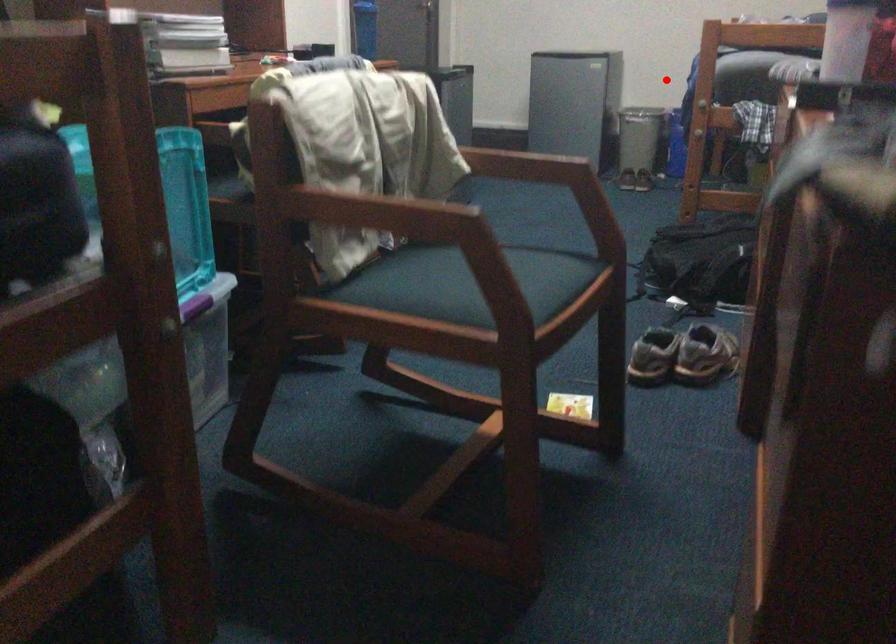
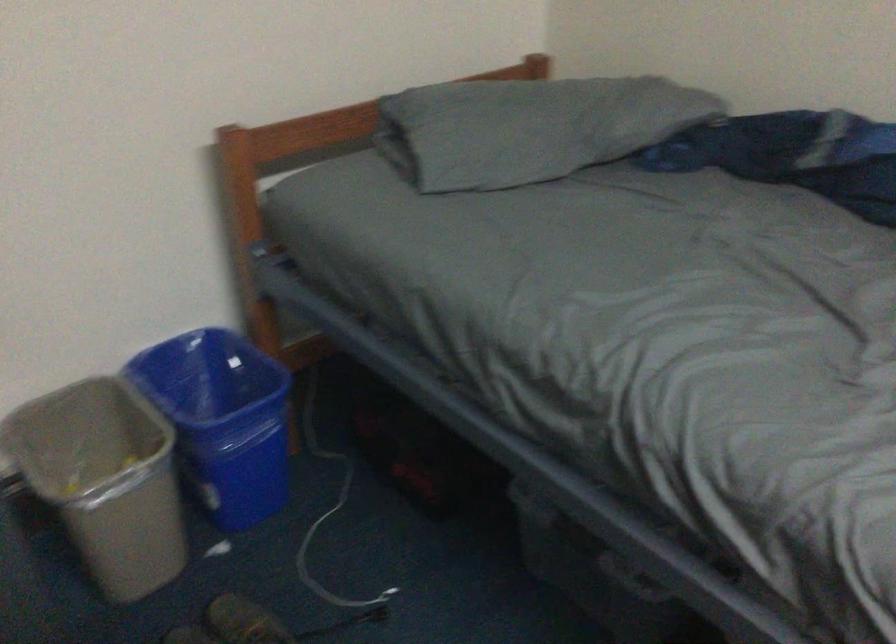
Question: I am providing you with two images of the same scene from different viewpoints. In image1, a red point is highlighted. Considering the same 3D point in image2, which of the following is correct?

Choices:
 (A) It is closer
 (B) It is farther

Answer: (A)